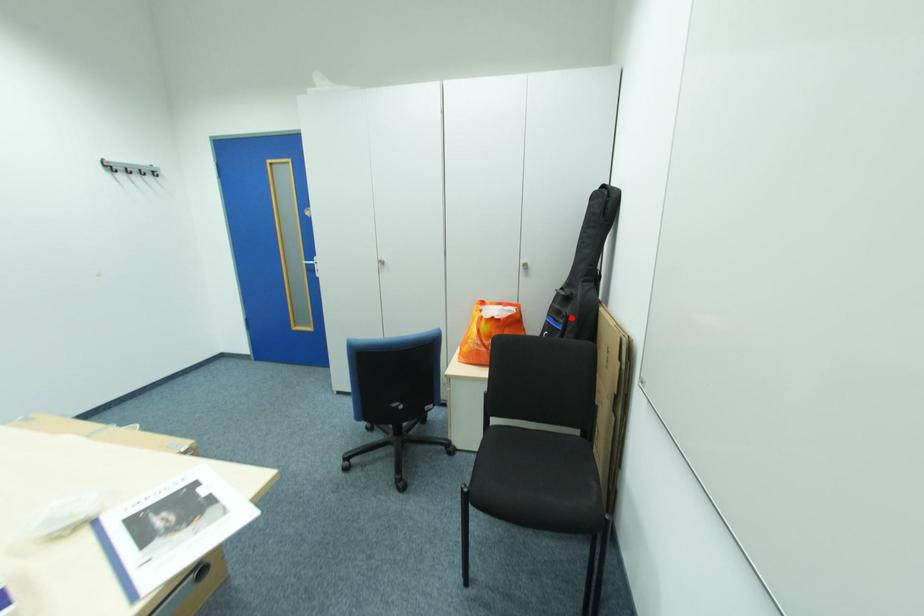
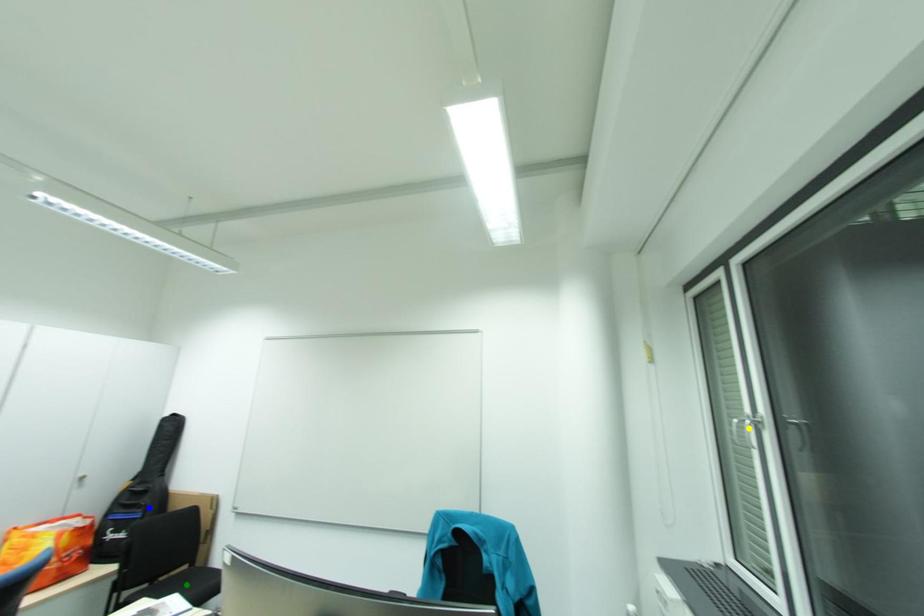
Question: I am providing you with two images of the same scene from different viewpoints. A red point is marked on the first image. You are given multiple points on the second image. In image 2, which mark is for the same physical point as the one in image 1?

Choices:
 (A) blue point
 (B) green point
 (C) yellow point

Answer: (A)